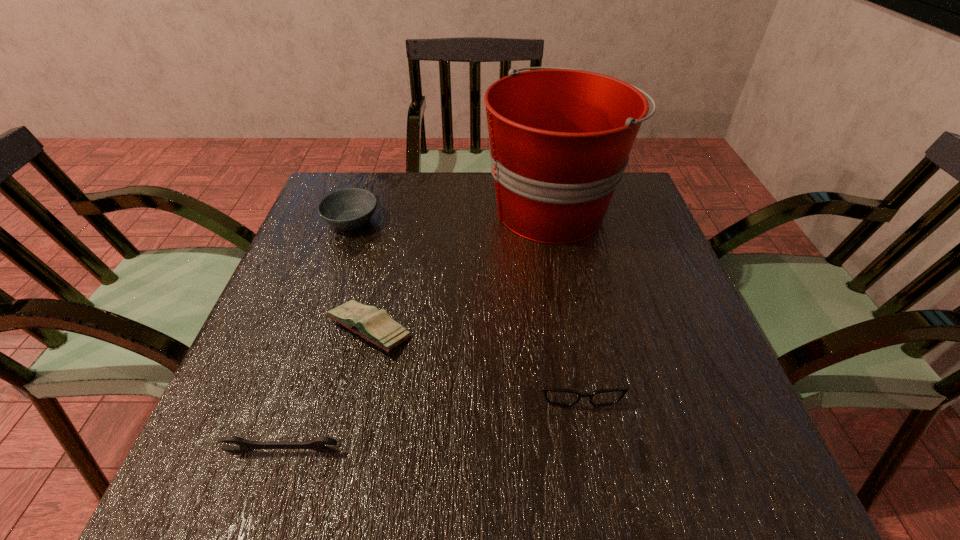
This screenshot has height=540, width=960. What are the coordinates of `free area in between the diary and the nearest object` in the screenshot? It's located at (326, 391).

Find the location of a particular element. Image resolution: width=960 pixels, height=540 pixels. free point between the wrench and the soup bowl is located at coordinates (318, 336).

Where is `unoccupied area between the diary and the soup bowl`? Image resolution: width=960 pixels, height=540 pixels. unoccupied area between the diary and the soup bowl is located at coordinates (361, 275).

Where is `free space between the spectacles and the tallest object`? free space between the spectacles and the tallest object is located at coordinates (564, 292).

What are the coordinates of `empty space between the nearest object and the soup bowl` in the screenshot? It's located at (318, 336).

I want to click on object that is the third closest to the spectacles, so click(317, 443).

Locate which object is the second closest to the diary. Please provide its 2D coordinates. Your answer should be formatted as a tuple, i.e. [(x, y)], where the tuple contains the x and y coordinates of a point satisfying the conditions above.

[(560, 139)]